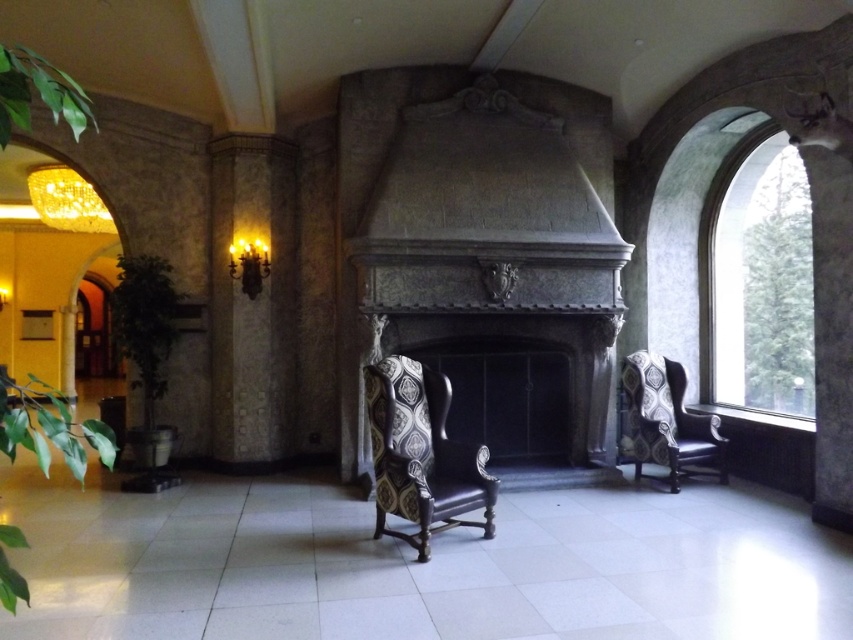
Question: Which of the following is the farthest from the observer?

Choices:
 (A) (791, 266)
 (B) (651, 422)
 (C) (456, 292)

Answer: (A)

Question: Is dark stone fireplace at center to the left of patterned fabric wingback chair at center from the viewer's perspective?

Choices:
 (A) yes
 (B) no

Answer: (B)

Question: Can you confirm if dark stone fireplace at center is positioned above patterned fabric wingback chair at right?

Choices:
 (A) no
 (B) yes

Answer: (B)

Question: Among these objects, which one is nearest to the camera?

Choices:
 (A) dark stone fireplace at center
 (B) patterned fabric wingback chair at right

Answer: (A)

Question: Estimate the real-world distances between objects in this image. Which object is closer to the clear glass window at right?

Choices:
 (A) dark stone fireplace at center
 (B) patterned fabric wingback chair at center
 (C) patterned fabric wingback chair at right

Answer: (C)

Question: Is clear glass window at right smaller than patterned fabric wingback chair at center?

Choices:
 (A) yes
 (B) no

Answer: (B)